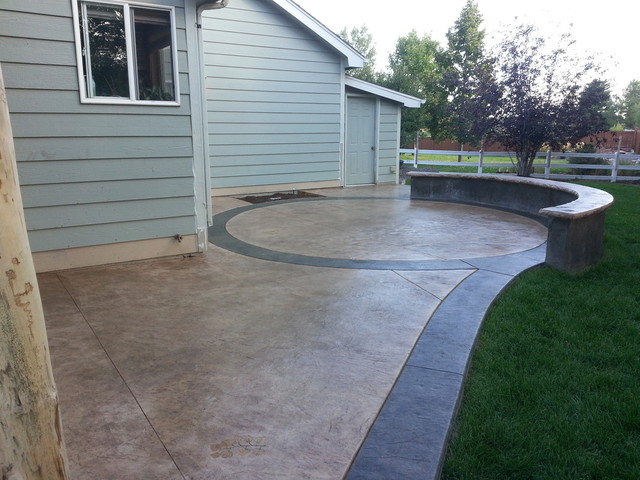
What are the coordinates of `white slanted roof` in the screenshot? It's located at (367, 87), (333, 44).